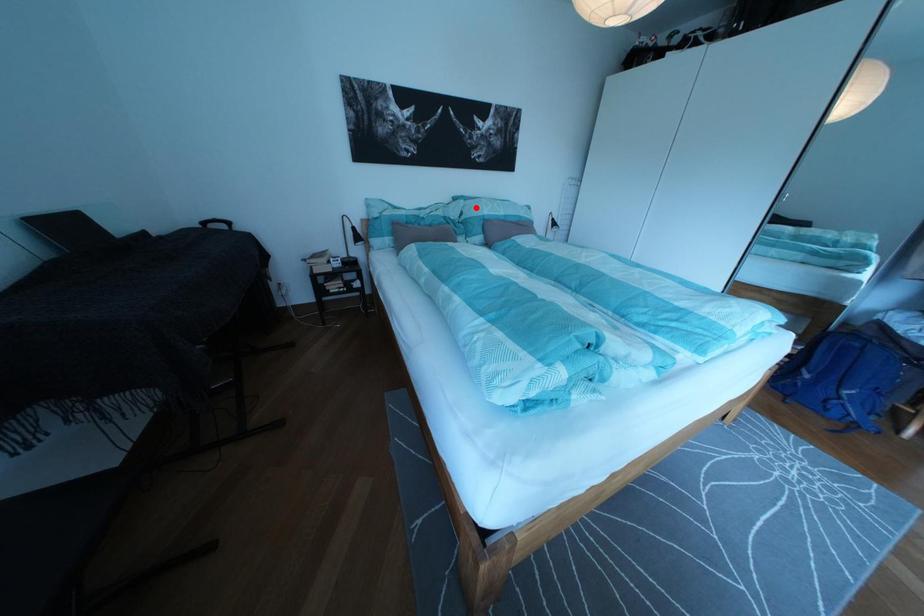
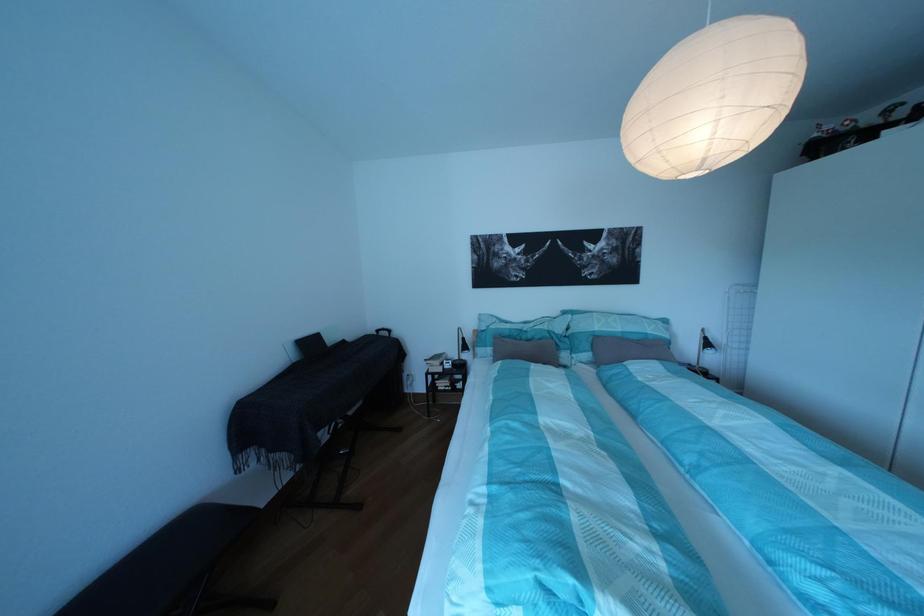
Question: I am providing you with two images of the same scene from different viewpoints. In image1, a red point is highlighted. Considering the same 3D point in image2, which of the following is correct?

Choices:
 (A) It is closer
 (B) It is farther

Answer: (B)